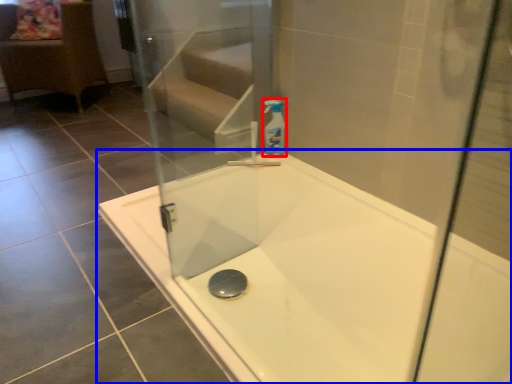
Question: Which of the following is the farthest to the observer, cleaning product (highlighted by a red box) or bathtub (highlighted by a blue box)?

Choices:
 (A) cleaning product
 (B) bathtub

Answer: (A)